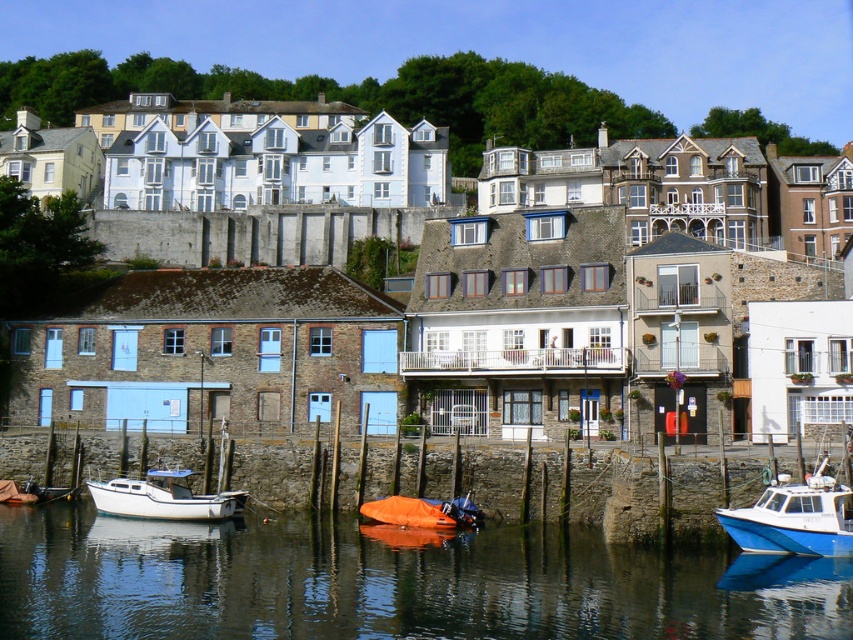
Question: Considering the real-world distances, which object is closest to the orange tarpaulin boat at lower center?

Choices:
 (A) white matte boat at lower left
 (B) blue glossy boat at lower right
 (C) transparent water at lower center

Answer: (A)

Question: Is transparent water at lower center bigger than orange tarpaulin boat at lower center?

Choices:
 (A) no
 (B) yes

Answer: (B)

Question: Which point is farther to the camera?

Choices:
 (A) transparent water at lower center
 (B) blue glossy boat at lower right

Answer: (B)

Question: Is white matte boat at lower left thinner than orange tarpaulin boat at lower center?

Choices:
 (A) no
 (B) yes

Answer: (B)

Question: Observing the image, what is the correct spatial positioning of white matte boat at lower left in reference to orange tarpaulin boat at lower center?

Choices:
 (A) left
 (B) right

Answer: (A)

Question: Which object is positioned farthest from the transparent water at lower center?

Choices:
 (A) blue glossy boat at lower right
 (B) orange tarpaulin boat at lower center
 (C) white matte boat at lower left

Answer: (C)